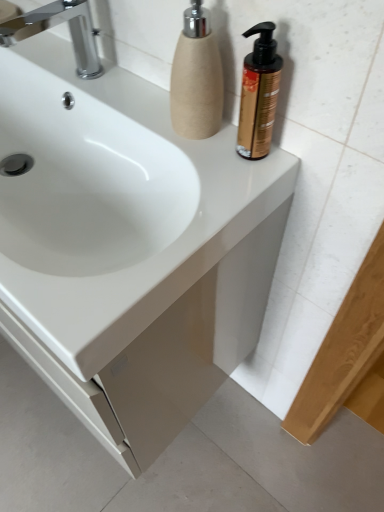
Locate an element on the screen. The width and height of the screenshot is (384, 512). free space between chrome metallic faucet at upper left and beige textured soap dispenser at upper right, which is the first soap dispenser in left-to-right order is located at coordinates (129, 100).